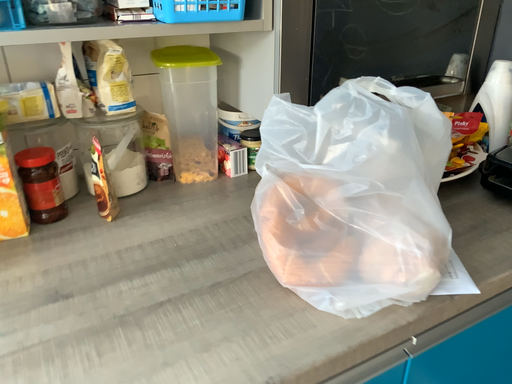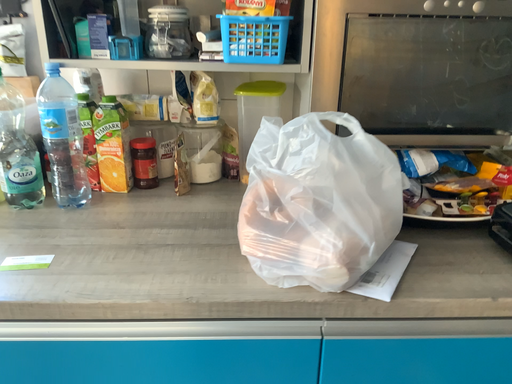
Question: How did the camera likely rotate when shooting the video?

Choices:
 (A) rotated left
 (B) rotated right

Answer: (A)